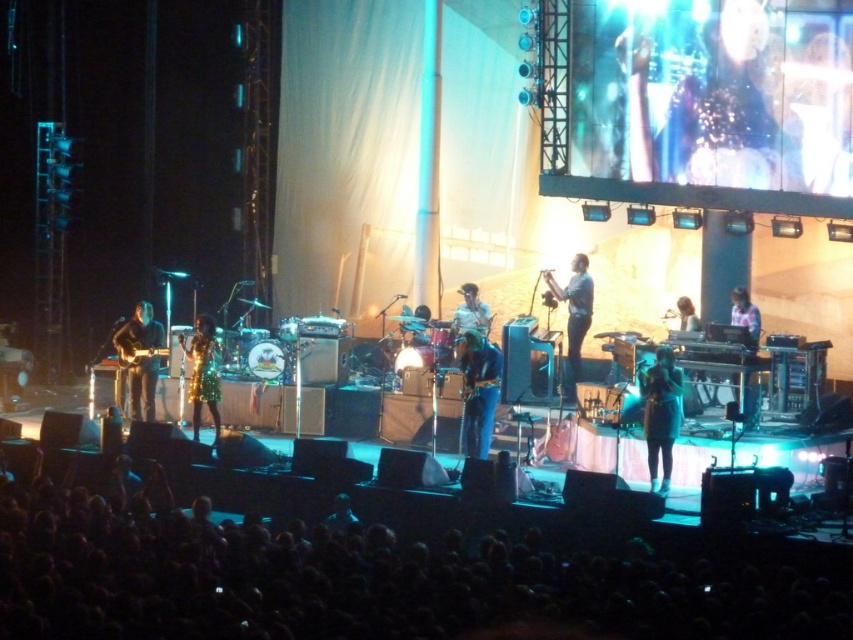
You are a photographer at the back of the concert venue and want to take a clear photo of the shiny blue jeans at center without the black fabric crowd at lower center blocking it. What should you do?

The black fabric crowd at lower center is closer to the viewer than the shiny blue jeans at center. To avoid blocking, you should adjust your angle or move to a higher position to get a clear shot of the shiny blue jeans at center without the black fabric crowd at lower center obstructing the view.

Based on the photo, you are a photographer trying to capture the drummer in the center of the stage. There are two black fabric items in your viewfinder. One is the black fabric crowd at lower center and the other is the satin black dress at center. Which one is blocking your view of the drummer?

The black fabric crowd at lower center is in front of the satin black dress at center, so the black fabric crowd at lower center is blocking your view of the drummer.